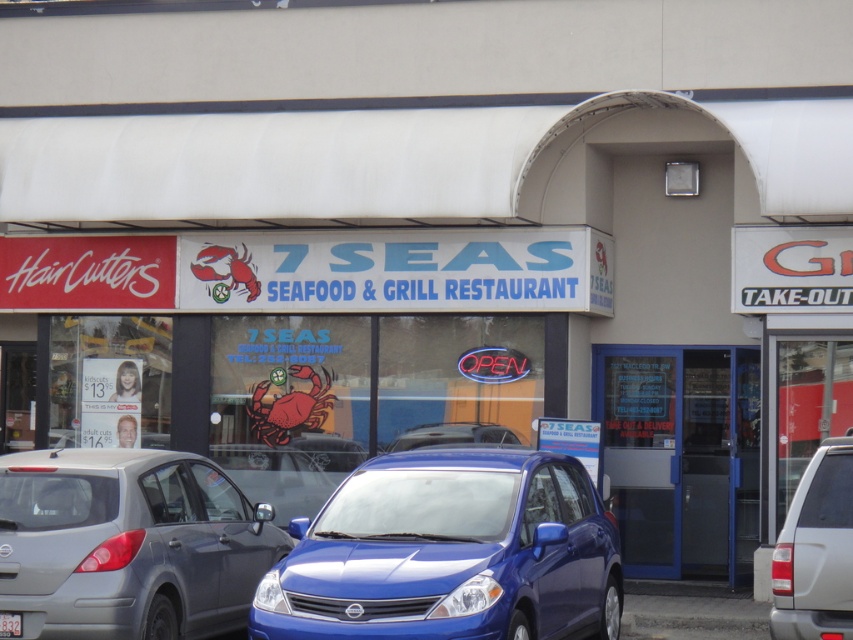
You are a customer arriving at the 7 Seas Seafood restaurant and notice a matte gray sedan at center and a white plastic license plate at center. Which object is nearer to you?

The matte gray sedan at center is closer to the viewer than the white plastic license plate at center.

Consider the image. You are a customer arriving at the 7 Seas Seafood restaurant and see the silver metallic suv at lower right and the white plastic license plate at center. Which object is closer to the entrance of the restaurant?

The silver metallic suv at lower right is positioned on the right side of the white plastic license plate at center, so the white plastic license plate at center is closer to the entrance of the restaurant.